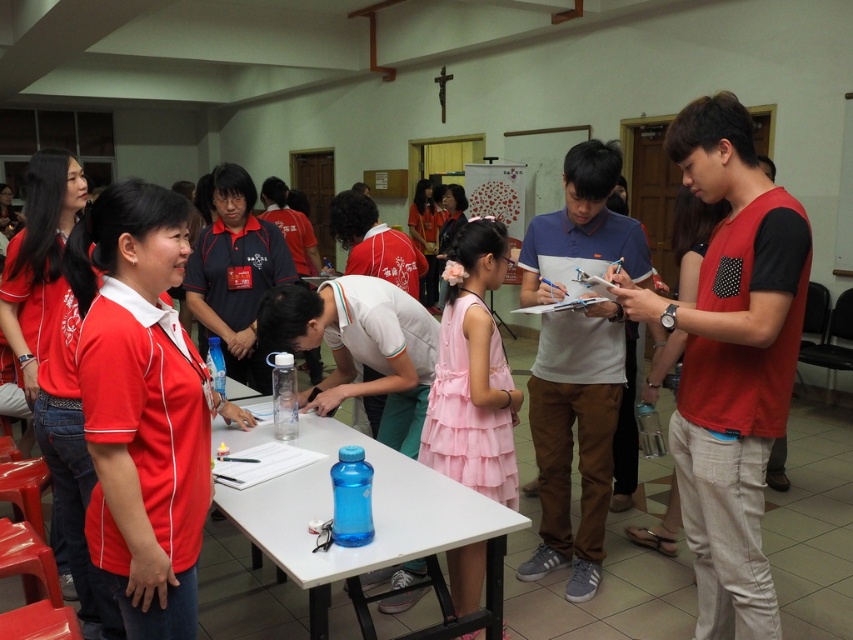
You are a person who is 1.6 meters tall. You want to reach the blue plastic table at center from where you are standing. Is the distance between you and the table sufficient for you to comfortably walk towards it without needing to move any obstacles?

The distance between you and the blue plastic table at center is 1.56 meters, which is sufficient for a person of 1.6 meters to comfortably walk towards it without needing to move any obstacles.

You are attending an event in a community hall and see a blue plastic table at center and a pink satin dress at center. Which object is located lower in the image?

The blue plastic table at center is positioned under the pink satin dress at center, so the table is lower than the dress.

You are attending an event in a community hall and see a pink satin dress at center and a white paper at center. Which object is closer to you?

The pink satin dress at center is closer to you because it is further to the viewer than the white paper at center.